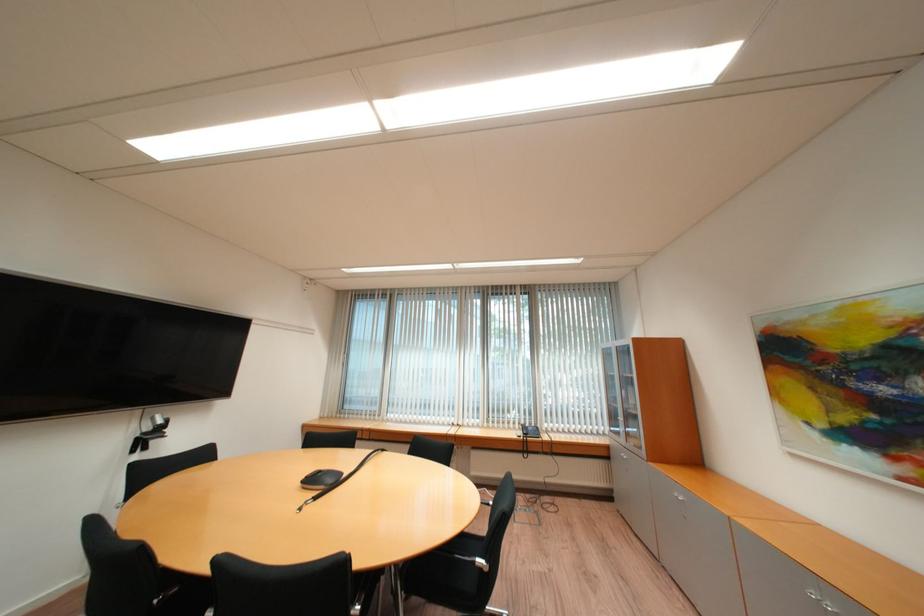
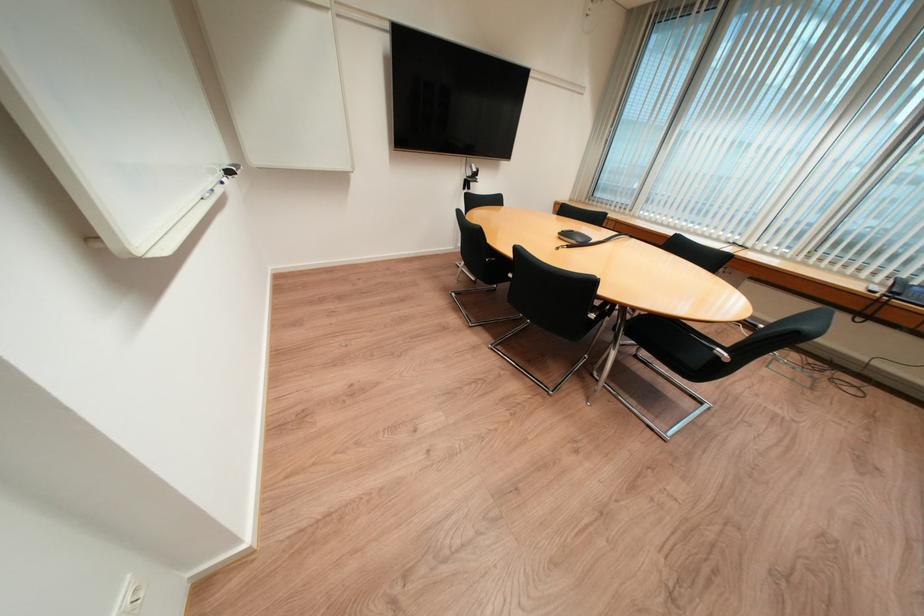
In the second image, find the point that corresponds to pixel 490 570 in the first image.

(725, 359)